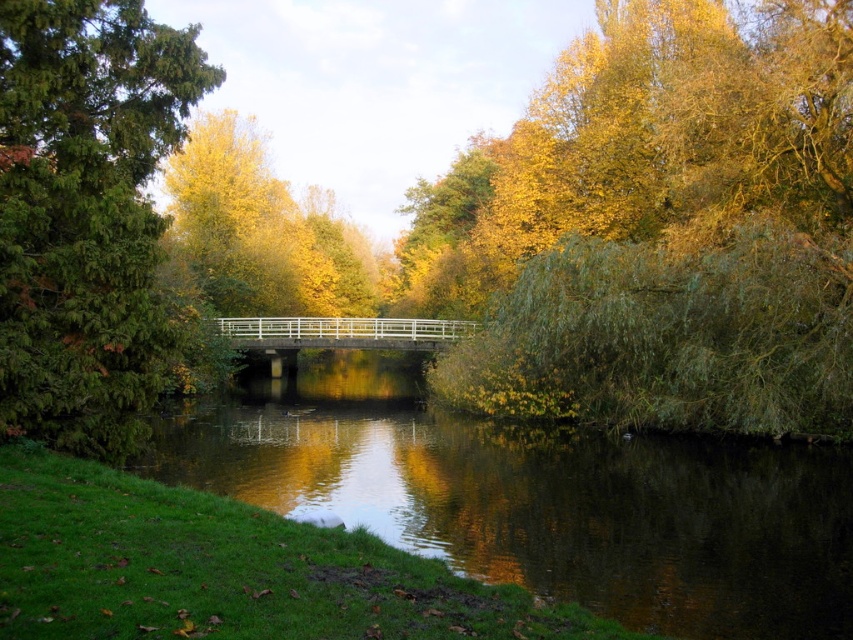
Based on the photo, you are standing on the small white bridge and want to pick up the golden textured leaves at right. In which direction should you move relative to the bridge to reach them?

The golden textured leaves at right are located at point (x=660, y=227), so you should move to the right side of the bridge to reach them.

You are a hiker standing on the small white bridge in the center of the river. You want to collect golden textured leaves at right and green coniferous tree at left. Which direction should you go to reach the closest object first?

The golden textured leaves at right and green coniferous tree at left are 17.65 meters apart. Since the distance is the same from the bridge to both objects, you can choose either direction to reach them first.

You are an artist painting the autumn scene. You want to highlight the golden textured leaves at right and the green coniferous tree at left in your painting. Which object should you paint larger to emphasize their contrast in size?

You should paint the golden textured leaves at right larger than the green coniferous tree at left because the golden textured leaves at right has a larger size compared to green coniferous tree at left.